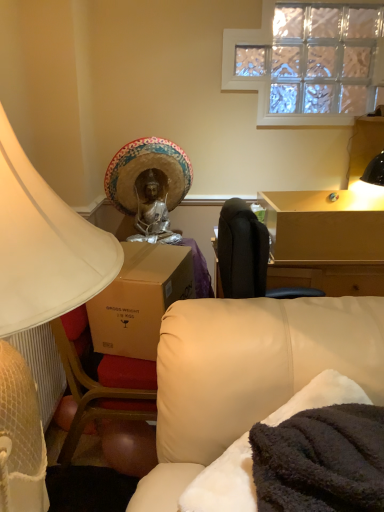
Question: From the image's perspective, relative to white matte lampshade at left, is leather couch at lower right above or below?

Choices:
 (A) above
 (B) below

Answer: (B)

Question: From a real-world perspective, is leather couch at lower right physically located above or below white matte lampshade at left?

Choices:
 (A) above
 (B) below

Answer: (B)

Question: Estimate the real-world distances between objects in this image. Which object is farther from the straw hat at upper center?

Choices:
 (A) clear glass window at upper center
 (B) light brown wooden table at upper right
 (C) leather couch at lower right
 (D) white matte lampshade at left

Answer: (D)

Question: Estimate the real-world distances between objects in this image. Which object is closer to the white matte lampshade at left?

Choices:
 (A) clear glass window at upper center
 (B) straw hat at upper center
 (C) light brown wooden table at upper right
 (D) leather couch at lower right

Answer: (D)